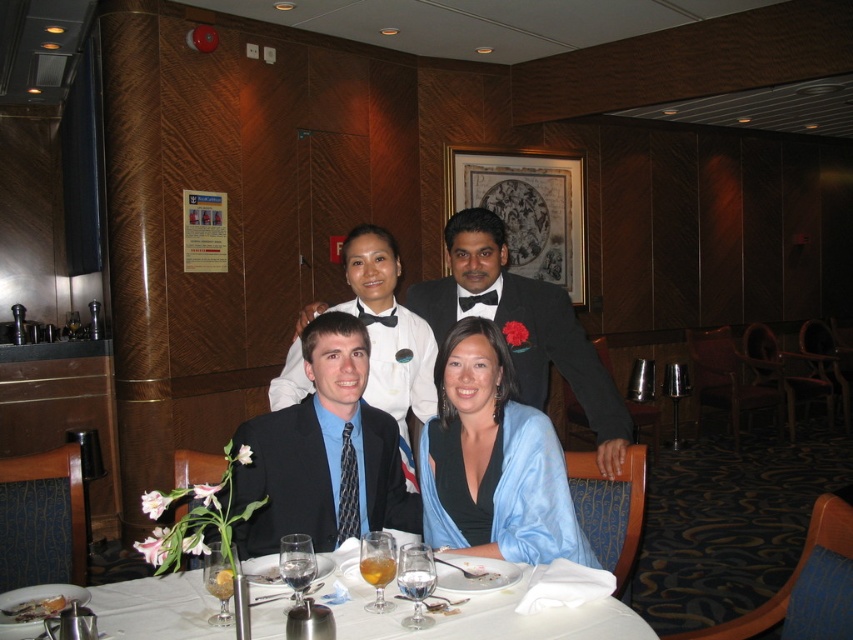
You are a photographer adjusting your camera settings. You notice the white cloth at lower center and the black satin bow tie at upper center in your viewfinder. Which object is closer to the camera lens?

The black satin bow tie at upper center is closer to the camera lens because it is positioned above the white cloth at lower center.

You are a photographer adjusting your camera to focus on the scene. You notice the white cloth at lower center and the black satin bow tie at upper center. Which object is shorter in height?

The white cloth at lower center has a lesser height compared to the black satin bow tie at upper center, so the white cloth at lower center is shorter in height.